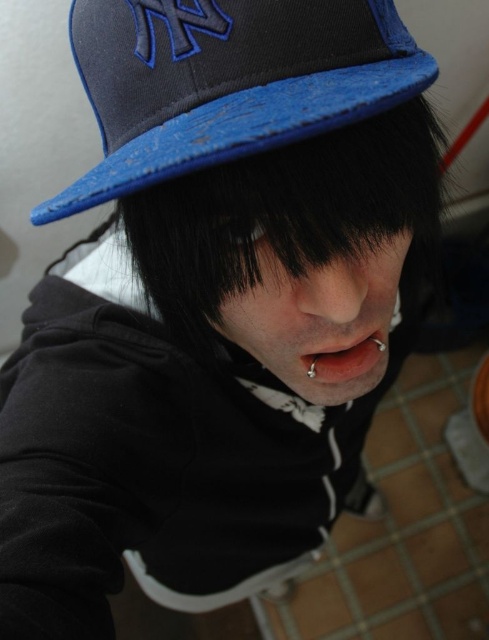
Is blue fabric baseball cap at upper center below smooth flesh lips at center?

No, blue fabric baseball cap at upper center is not below smooth flesh lips at center.

Is point (43, 209) closer to camera compared to point (315, 376)?

Yes.

At what (x,y) coordinates should I click in order to perform the action: click on blue fabric baseball cap at upper center. Please return your answer as a coordinate pair (x, y). The height and width of the screenshot is (640, 489). Looking at the image, I should click on (226, 81).